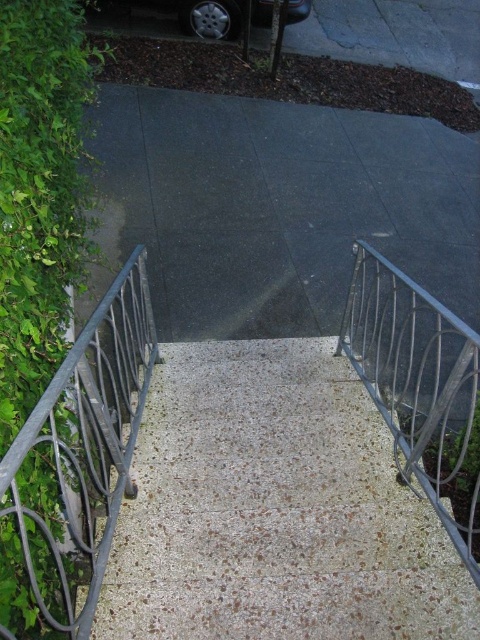
You are a delivery person trying to unload a package from your silver metallic car at upper center onto the speckled concrete stairs at center. Will the stairs be tall enough to place the package on top of them without needing a ladder?

The speckled concrete stairs at center has a greater height compared to the silver metallic car at upper center, so the stairs are taller than the car. Therefore, you will need a ladder to reach the top of the stairs from the car.

From the picture: You are a delivery person trying to park your 2.5 meter wide silver metallic car at upper center. There is a green leafy hedge at left nearby. Can you safely park your car without damaging the hedge?

The distance between the green leafy hedge at left and the silver metallic car at upper center is 5.92 meters. Since the car is only 2.5 meters wide, there is sufficient space between them to park safely without damaging the hedge.

You are standing at the bottom of the outdoor concrete stairs and want to walk towards the silver metallic car at upper center. Will the green leafy hedge at left block your path?

The green leafy hedge at left is in front of the silver metallic car at upper center, so it will block your path when walking towards the silver metallic car at upper center.